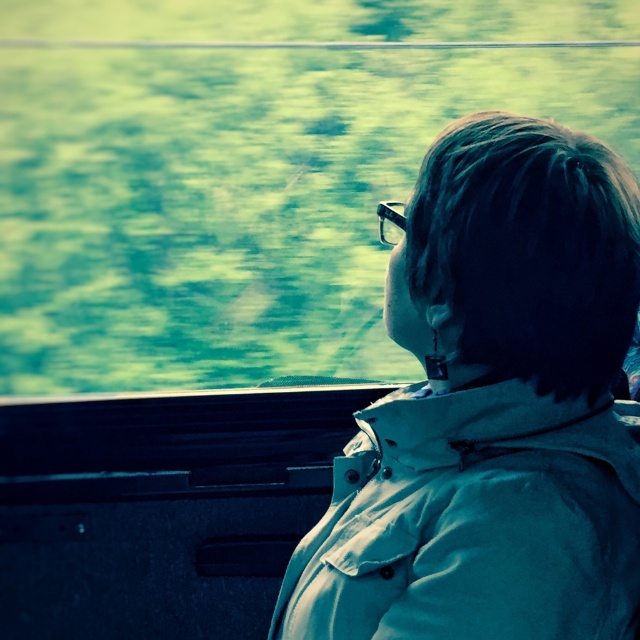
You are inside a moving train and notice two points marked on the window. The first point is at coordinate point (236,150) and the second is at point (426,608). Which point is closer to you?

Point (236,150) is further to the camera than point (426,608), so the point closer to you is point (426,608).

You are a passenger on a train and need to wear your clear plastic goggles at center while looking through the transparent glass train window at center. Will the goggles fit over the window without overlapping the edges?

The transparent glass train window at center is wider than the clear plastic goggles at center, so the goggles will fit over the window without overlapping the edges.

You are a passenger in the train and you want to place a 10cm wide book on the seat next to the white matte trench coat at center. Is there enough space?

The position of white matte trench coat at center is at point (474, 522), but without knowing the exact dimensions of the seat and the distance from the trench coat to the edge of the seat, it is impossible to determine if there is enough space for the book.